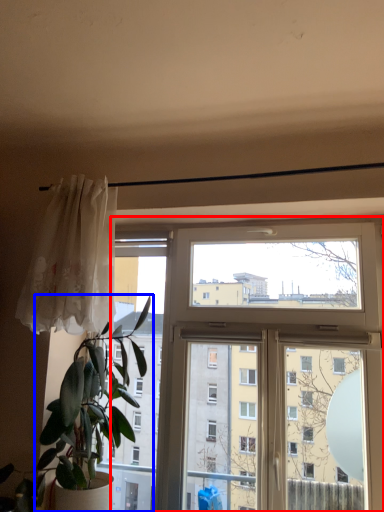
Question: Which of the following is the farthest to the observer, window (highlighted by a red box) or houseplant (highlighted by a blue box)?

Choices:
 (A) window
 (B) houseplant

Answer: (A)